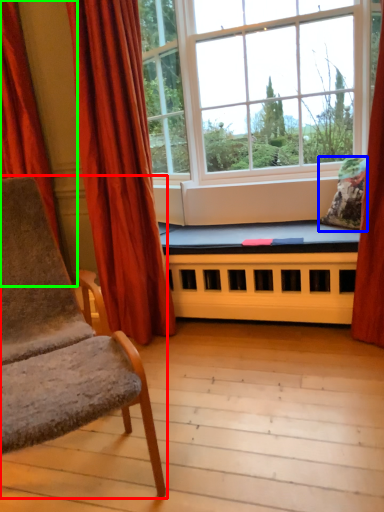
Question: Based on their relative distances, which object is nearer to chair (highlighted by a red box)? Choose from pillow (highlighted by a blue box) and curtain (highlighted by a green box).

Choices:
 (A) pillow
 (B) curtain

Answer: (B)